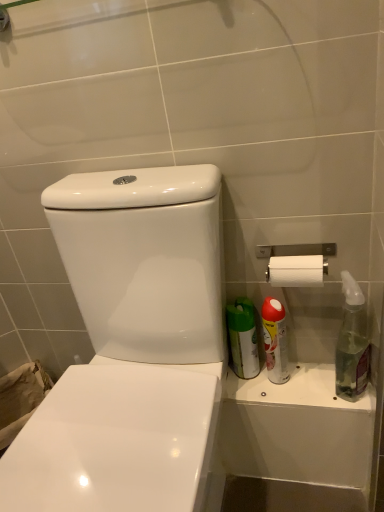
The image size is (384, 512). What are the coordinates of `vacant space to the right of red matte spray can at right, the second cleaning product in the right-to-left sequence` in the screenshot? It's located at (322, 371).